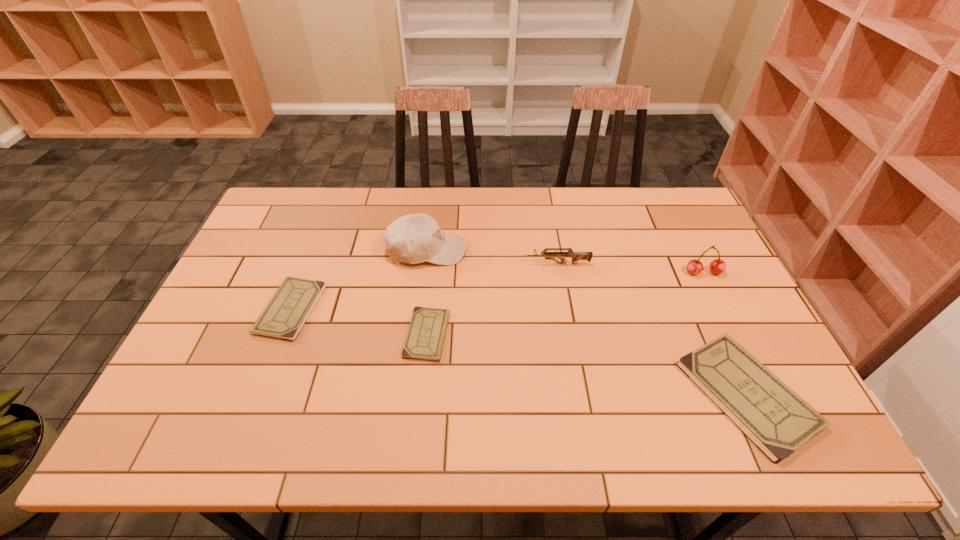
You are a GUI agent. You are given a task and a screenshot of the screen. Output one action in this format:
    pyautogui.click(x=<x>, y=<y>)
    Task: Click on the vacant area located 0.070m on the right of the fifth tallest object
    Image resolution: width=960 pixels, height=540 pixels.
    Given the screenshot: What is the action you would take?
    pyautogui.click(x=345, y=309)

Where is `free location located 0.090m on the left of the second checkbook from left to right`? free location located 0.090m on the left of the second checkbook from left to right is located at coordinates (371, 334).

Locate an element on the screen. The image size is (960, 540). blank space located on the back of the rightmost checkbook is located at coordinates (677, 243).

Locate an element on the screen. The height and width of the screenshot is (540, 960). blank space located aimed along the barrel of the gun is located at coordinates tap(484, 264).

The image size is (960, 540). In order to click on vacant region located aimed along the barrel of the gun in this screenshot , I will do `click(396, 264)`.

Where is `blank space located 0.130m aimed along the barrel of the gun`? blank space located 0.130m aimed along the barrel of the gun is located at coordinates (481, 264).

Locate an element on the screen. vacant point located 0.370m on the front-facing side of the baseball cap is located at coordinates (585, 250).

You are a GUI agent. You are given a task and a screenshot of the screen. Output one action in this format:
    pyautogui.click(x=<x>, y=<y>)
    Task: Click on the free spot located with stems pointing upwards on the cherry
    The image size is (960, 540).
    Given the screenshot: What is the action you would take?
    pyautogui.click(x=733, y=334)

Find the location of a particular element. Image resolution: width=960 pixels, height=540 pixels. object located in the near edge section of the desktop is located at coordinates (778, 421).

This screenshot has height=540, width=960. I want to click on object at the left edge, so click(286, 313).